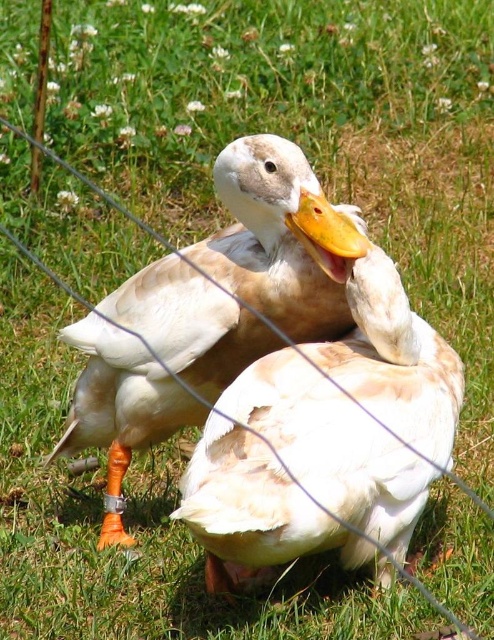
You are a birdwatcher trying to identify ducks in the image. You notice the white matte duck at center and the yellow matte beak at center. Which object is taller?

The white matte duck at center is taller than the yellow matte beak at center.